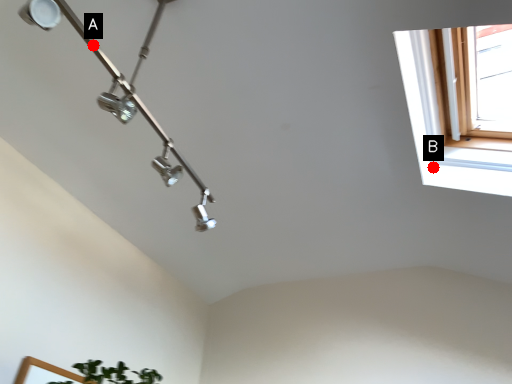
Question: Two points are circled on the image, labeled by A and B beside each circle. Which point appears closest to the camera in this image?

Choices:
 (A) A is closer
 (B) B is closer

Answer: (A)